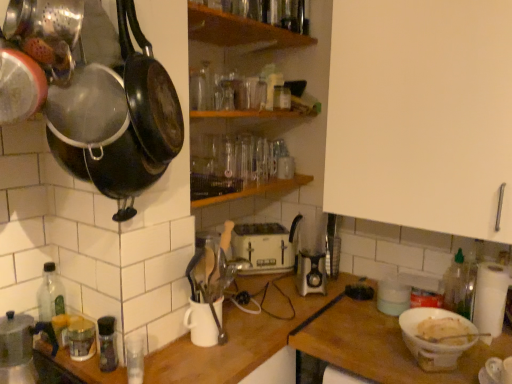
Image resolution: width=512 pixels, height=384 pixels. In order to click on vacant area that lies to the right of translucent glass spice at lower left, the 2th bottle from the left in this screenshot , I will do 168,357.